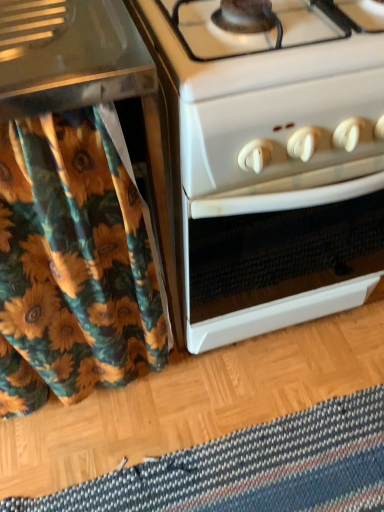
Question: Does floral fabric shower curtain at left have a larger size compared to white glossy oven at center?

Choices:
 (A) no
 (B) yes

Answer: (A)

Question: Is floral fabric shower curtain at left positioned with its back to white glossy oven at center?

Choices:
 (A) no
 (B) yes

Answer: (A)

Question: Considering the relative sizes of floral fabric shower curtain at left and white glossy oven at center in the image provided, is floral fabric shower curtain at left shorter than white glossy oven at center?

Choices:
 (A) no
 (B) yes

Answer: (A)

Question: Can you confirm if floral fabric shower curtain at left is smaller than white glossy oven at center?

Choices:
 (A) yes
 (B) no

Answer: (A)

Question: Is the position of floral fabric shower curtain at left less distant than that of white glossy oven at center?

Choices:
 (A) yes
 (B) no

Answer: (A)

Question: Does floral fabric shower curtain at left turn towards white glossy oven at center?

Choices:
 (A) no
 (B) yes

Answer: (A)

Question: Considering the relative sizes of striped woolen mat at lower center and floral fabric shower curtain at left in the image provided, is striped woolen mat at lower center thinner than floral fabric shower curtain at left?

Choices:
 (A) no
 (B) yes

Answer: (A)

Question: From the image's perspective, is striped woolen mat at lower center above floral fabric shower curtain at left?

Choices:
 (A) no
 (B) yes

Answer: (A)

Question: Does striped woolen mat at lower center have a larger size compared to floral fabric shower curtain at left?

Choices:
 (A) yes
 (B) no

Answer: (B)

Question: From a real-world perspective, is striped woolen mat at lower center below floral fabric shower curtain at left?

Choices:
 (A) yes
 (B) no

Answer: (A)

Question: Considering the relative sizes of striped woolen mat at lower center and floral fabric shower curtain at left in the image provided, is striped woolen mat at lower center shorter than floral fabric shower curtain at left?

Choices:
 (A) yes
 (B) no

Answer: (A)

Question: Does striped woolen mat at lower center have a greater width compared to floral fabric shower curtain at left?

Choices:
 (A) no
 (B) yes

Answer: (B)

Question: From a real-world perspective, is floral fabric shower curtain at left physically above striped woolen mat at lower center?

Choices:
 (A) yes
 (B) no

Answer: (A)